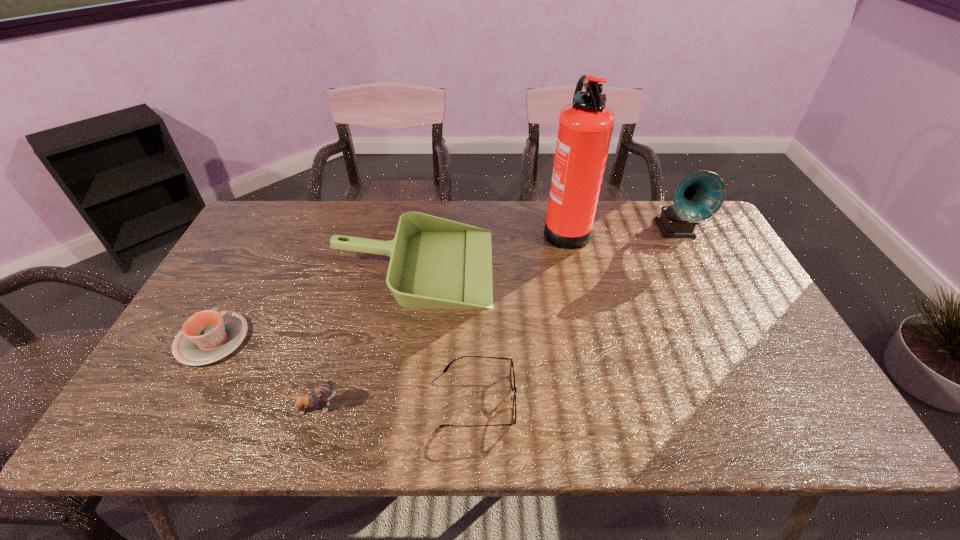
Identify the location of vacant point located at the nozzle of the fifth object from left to right. The height and width of the screenshot is (540, 960). (434, 228).

The height and width of the screenshot is (540, 960). I want to click on free space located at the nozzle of the fifth object from left to right, so click(428, 228).

Where is `vacant area situated 0.190m from the horn of the phonograph_record`? vacant area situated 0.190m from the horn of the phonograph_record is located at coordinates (707, 291).

Image resolution: width=960 pixels, height=540 pixels. Identify the location of vacant area situated on the scoop of the dustpan. (525, 266).

Find the location of a particular element. This screenshot has width=960, height=540. vacant space positioned 0.170m on the front-facing side of the kitten is located at coordinates (420, 408).

Find the location of a particular element. This screenshot has height=540, width=960. free space located on the handle side of the second shortest object is located at coordinates (253, 267).

This screenshot has width=960, height=540. What are the coordinates of `vacant space located on the handle side of the second shortest object` in the screenshot? It's located at (259, 255).

Locate an element on the screen. The width and height of the screenshot is (960, 540). vacant region located on the handle side of the second shortest object is located at coordinates (251, 271).

This screenshot has width=960, height=540. Find the location of `free region located 0.270m on the front-facing side of the shortest object`. free region located 0.270m on the front-facing side of the shortest object is located at coordinates (635, 398).

You are a GUI agent. You are given a task and a screenshot of the screen. Output one action in this format:
    pyautogui.click(x=<x>, y=<y>)
    Task: Click on the fire extinguisher at the far edge
    This screenshot has width=960, height=540.
    Given the screenshot: What is the action you would take?
    pyautogui.click(x=585, y=128)